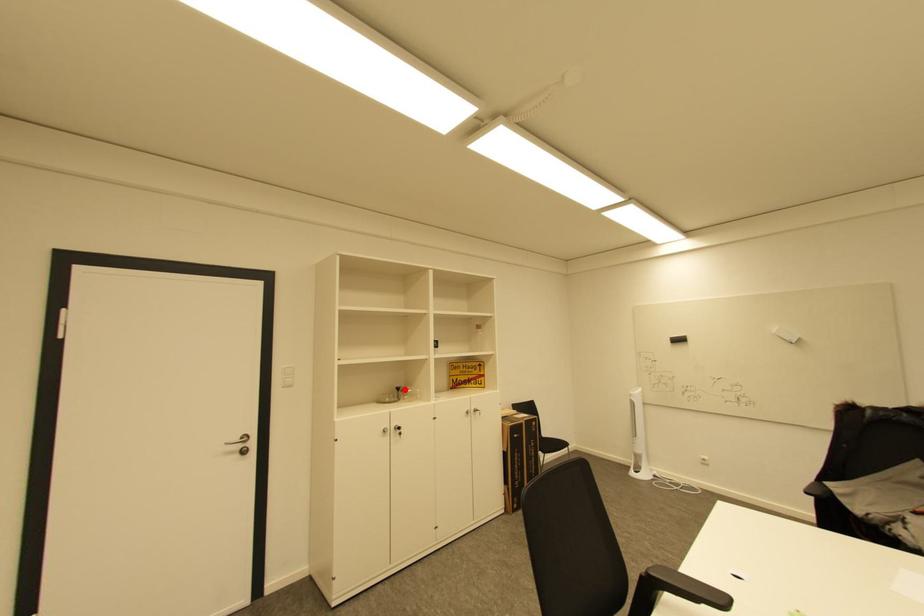
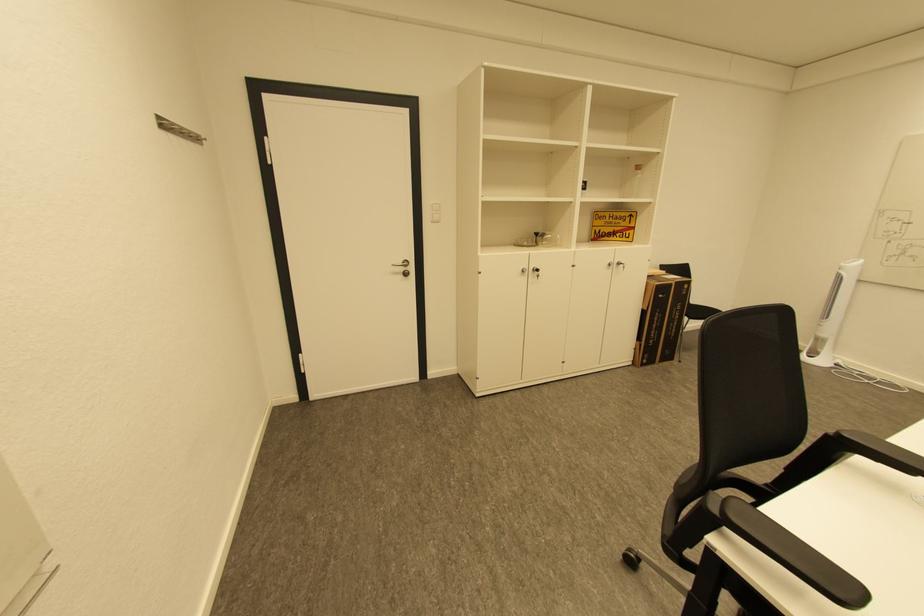
Question: A red point is marked in image1. In image2, is the corresponding 3D point closer to the camera or farther? Reply with the corresponding letter.

Choices:
 (A) The corresponding 3D point is closer.
 (B) The corresponding 3D point is farther.

Answer: (A)